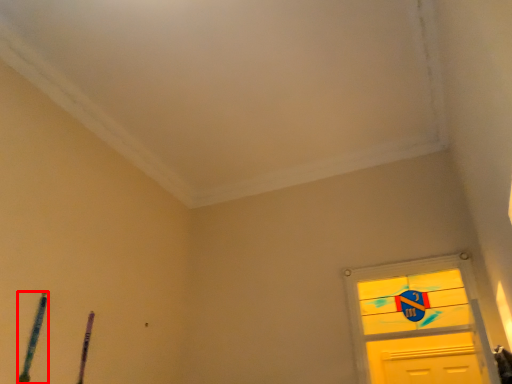
Question: Observing the image, what is the correct spatial positioning of twin (annotated by the red box) in reference to twin?

Choices:
 (A) left
 (B) right

Answer: (A)